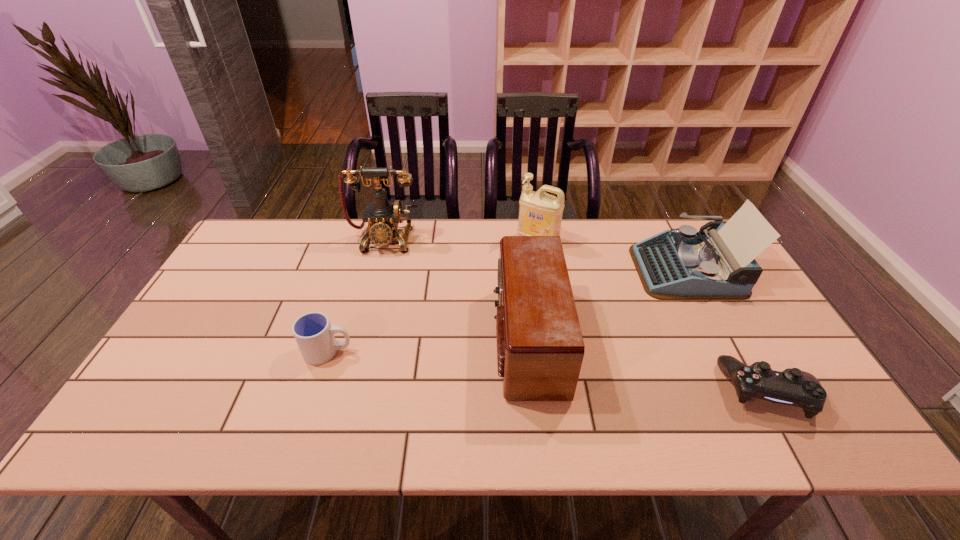
At what (x,y) coordinates should I click in order to perform the action: click on telephone. Please return your answer as a coordinate pair (x, y). Looking at the image, I should click on (383, 217).

This screenshot has height=540, width=960. Find the location of `detergent`. detergent is located at coordinates (540, 214).

In order to click on typewriter in this screenshot , I will do `click(717, 263)`.

At what (x,y) coordinates should I click in order to perform the action: click on radio receiver. Please return your answer as a coordinate pair (x, y). The height and width of the screenshot is (540, 960). Looking at the image, I should click on (540, 348).

Locate an element on the screen. This screenshot has width=960, height=540. cup is located at coordinates (314, 334).

This screenshot has width=960, height=540. What are the coordinates of `control` in the screenshot? It's located at (793, 387).

In order to click on free point located on the front of the telephone, featuring the rotary dial in this screenshot , I will do `click(370, 297)`.

Locate an element on the screen. Image resolution: width=960 pixels, height=540 pixels. vacant space located on the right of the detergent is located at coordinates point(658,241).

Identify the location of free region located on the typing side of the typewriter. This screenshot has width=960, height=540. (549, 269).

Find the location of a particular element. vacant region located on the typing side of the typewriter is located at coordinates (604, 269).